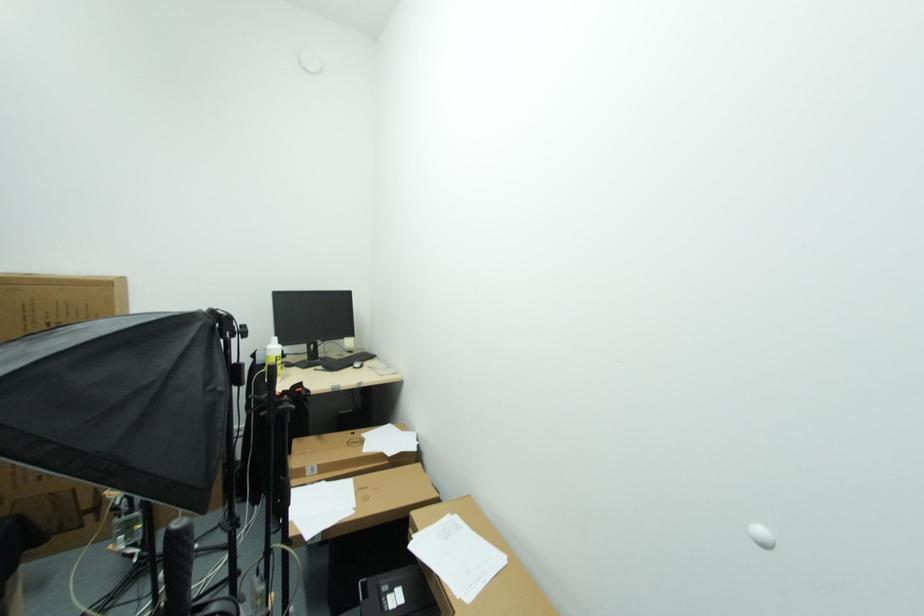
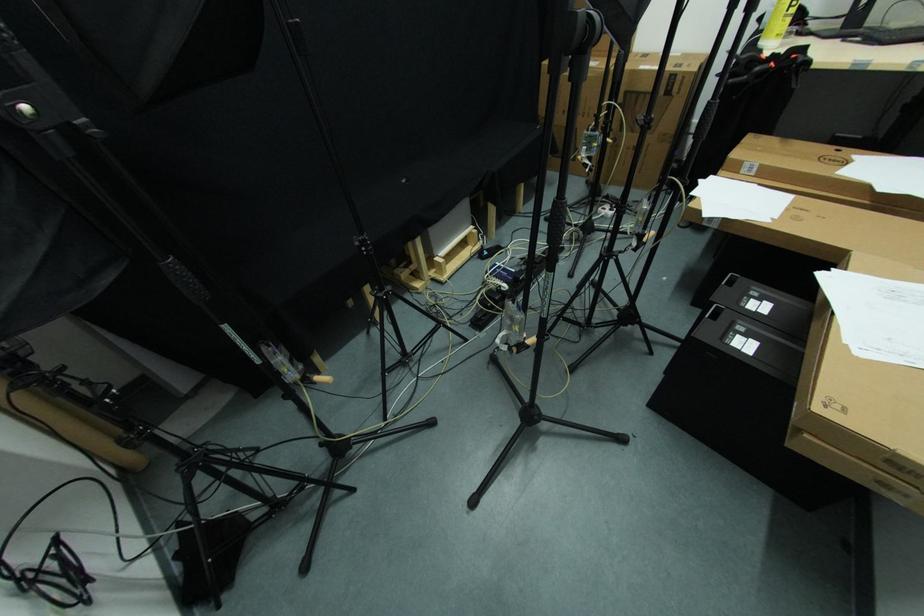
In the second image, find the point that corresponds to [280,361] in the first image.

(796, 6)